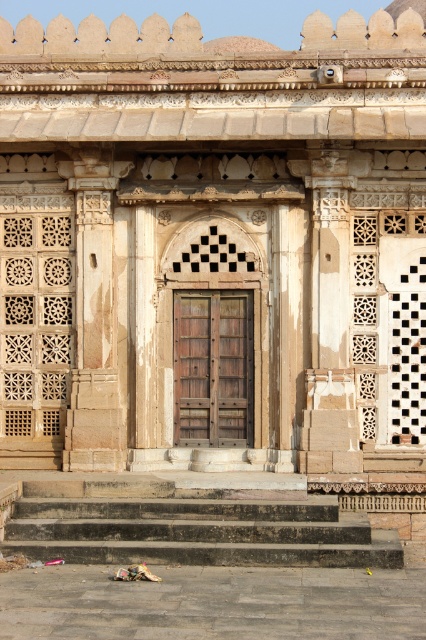
You are a visitor standing at the base of the dark gray stone stairs at lower center, looking up towards the wooden textured door at center. Which object is closer to you?

The dark gray stone stairs at lower center is closer to you since you are standing on them, while the wooden textured door at center is further away.